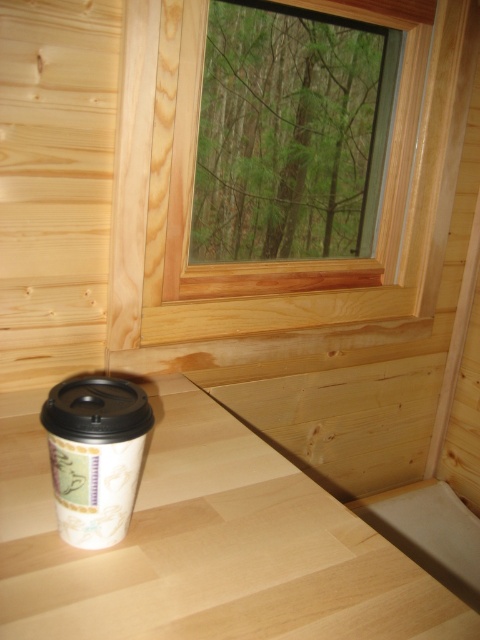
You are placing a small plant pot on the white wood table at lower center. If you want to move it to the white paper cup at lower left, which direction should you move it?

You should move the small plant pot to the left, as the white paper cup at lower left is to the left of the white wood table at lower center.

You are placing a white paper cup at lower left on the white wood table at lower center. Will the cup fit entirely on the table?

The white wood table at lower center might be wider than white paper cup at lower left, so there is a possibility that the cup will fit, but it is uncertain without exact measurements.